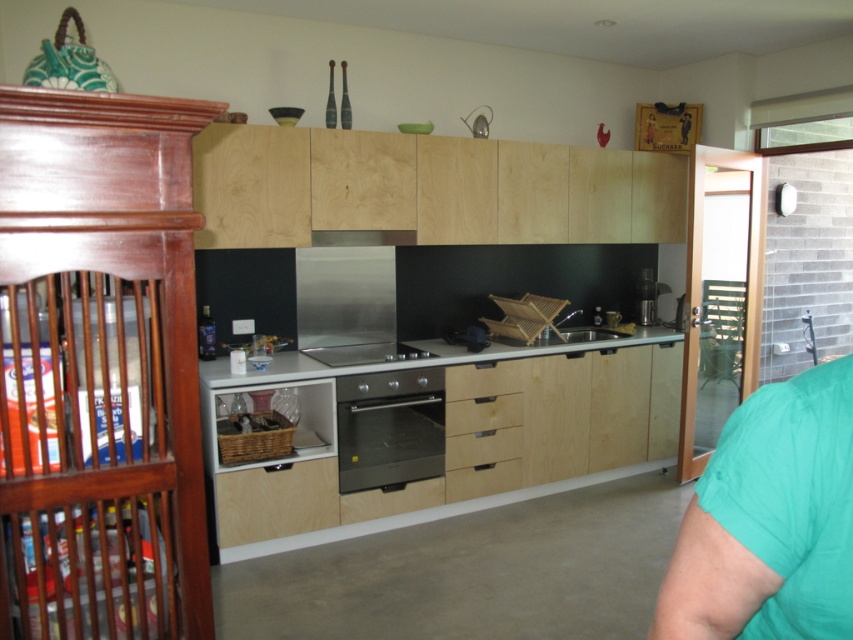
Question: Is the position of light wood/dark finish drawer at center more distant than that of wooden drawer at center?

Choices:
 (A) yes
 (B) no

Answer: (B)

Question: Among these objects, which one is farthest from the camera?

Choices:
 (A) white glossy countertop at center
 (B) light wood/dark finish drawer at center
 (C) matte wood counter top at center
 (D) wooden drawer at center

Answer: (D)

Question: Is light wood drawer at center to the left of stainless steel stove at center from the viewer's perspective?

Choices:
 (A) yes
 (B) no

Answer: (B)

Question: Can you confirm if white glossy countertop at center is positioned above stainless steel exhaust hood at center?

Choices:
 (A) yes
 (B) no

Answer: (B)

Question: Which object is positioned farthest from the wooden drawer at center?

Choices:
 (A) stainless steel oven at center
 (B) stainless steel exhaust hood at center
 (C) light wood drawer at center
 (D) light wood/dark finish drawer at center

Answer: (B)

Question: Which object is closer to the camera taking this photo?

Choices:
 (A) stainless steel exhaust hood at center
 (B) matte wood counter top at center
 (C) stainless steel oven at center
 (D) white glossy countertop at center

Answer: (B)